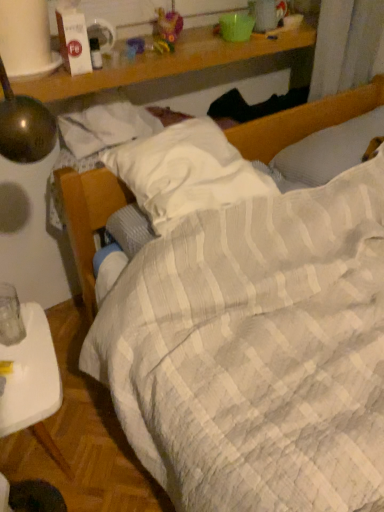
Locate an element on the screen. empty space that is ontop of white plastic tray at lower left (from a real-world perspective) is located at coordinates (24, 361).